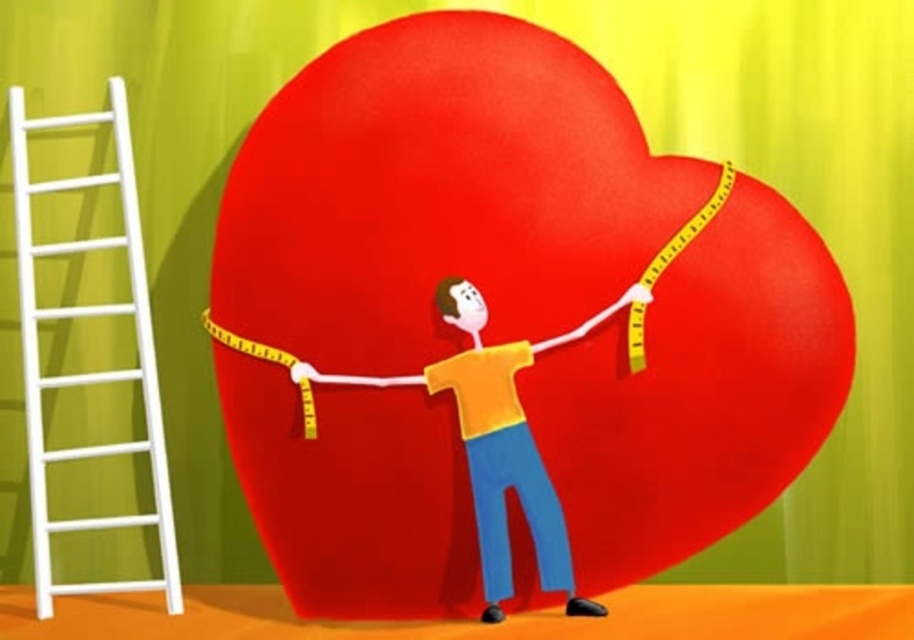
You are an architect designing a new building and need to place two points for structural support. The first point is at coordinate point(67, 307) and the second at point(494, 529). According to the image, which point is closer to the viewer?

Point(494, 529) is closer to the viewer than point(67, 307).

You are an interior designer who needs to place a new painting on the wall. You see the white wooden ladder at left and the yellow matte shirt at center in the scene. Which object is closer to the left side of the wall?

The white wooden ladder at left is closer to the left side of the wall because it is positioned to the left of the yellow matte shirt at center.

You are an architect designing a new sculpture based on this image. You need to ensure that the point at position (787, 403) and the point at (97, 237) are visible from the front. Which point should you prioritize placing closer to the front of the sculpture?

The point at position (787, 403) should be prioritized closer to the front of the sculpture because it is already closer to the camera than the point at (97, 237), ensuring visibility from the front view.